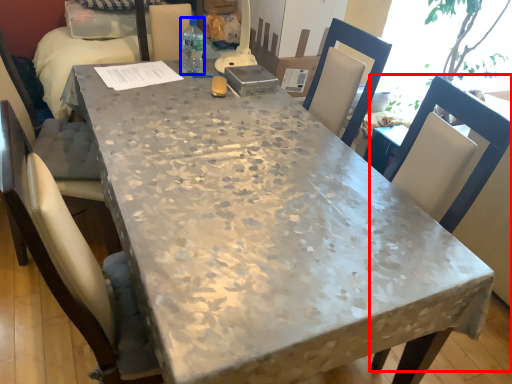
Question: Among these objects, which one is farthest to the camera, chair (highlighted by a red box) or bottle (highlighted by a blue box)?

Choices:
 (A) chair
 (B) bottle

Answer: (B)